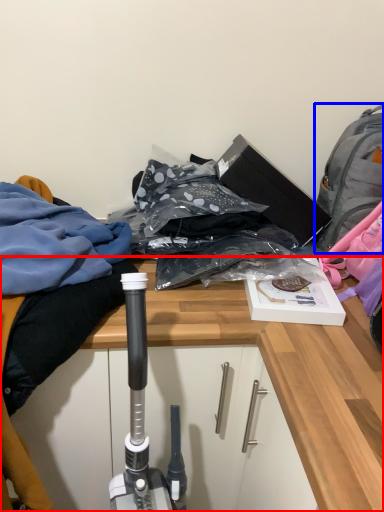
Question: Among these objects, which one is farthest to the camera, desk (highlighted by a red box) or backpack (highlighted by a blue box)?

Choices:
 (A) desk
 (B) backpack

Answer: (B)